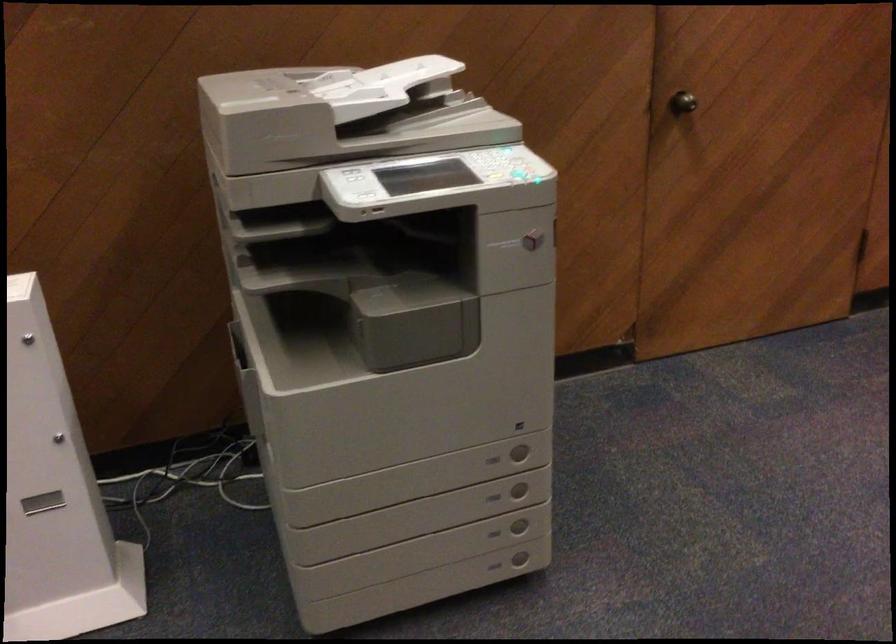
Find where to press the glowing printer button. Please return your answer as a coordinate pair (x, y).

(521, 176)